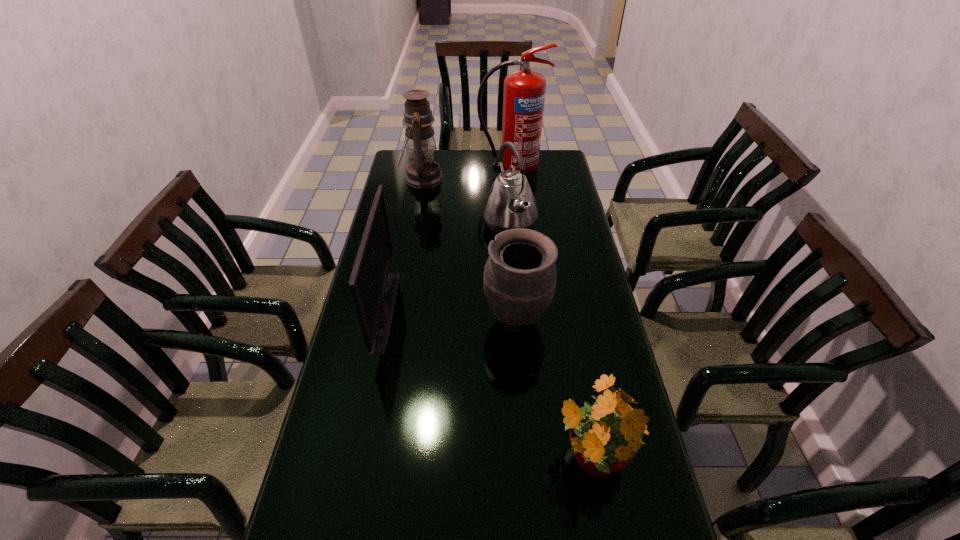
In the image, there is a desktop. Where is `vacant space at the left edge`? This screenshot has width=960, height=540. vacant space at the left edge is located at coordinates (349, 482).

At what (x,y) coordinates should I click in order to perform the action: click on vacant space at the right edge of the desktop. Please return your answer as a coordinate pair (x, y). Looking at the image, I should click on (537, 193).

Find the location of a particular element. This screenshot has height=540, width=960. vacant space at the far left corner of the desktop is located at coordinates (399, 148).

At what (x,y) coordinates should I click in order to perform the action: click on vacant area that lies between the oil lamp and the tallest object. Please return your answer as a coordinate pair (x, y). The image size is (960, 540). Looking at the image, I should click on (466, 177).

Where is `vacant space that's between the monitor and the urn`? The height and width of the screenshot is (540, 960). vacant space that's between the monitor and the urn is located at coordinates (451, 315).

Locate an element on the screen. This screenshot has height=540, width=960. free space between the monitor and the flowerpot is located at coordinates (488, 384).

Find the location of a particular element. empty space between the oil lamp and the fire extinguisher is located at coordinates (466, 177).

Image resolution: width=960 pixels, height=540 pixels. What are the coordinates of `vacant region between the monitor and the fire extinguisher` in the screenshot? It's located at (447, 243).

Where is `object identified as the fifth closest to the oil lamp`? object identified as the fifth closest to the oil lamp is located at coordinates (605, 435).

Choose which object is the second nearest neighbor to the oil lamp. Please provide its 2D coordinates. Your answer should be formatted as a tuple, i.e. [(x, y)], where the tuple contains the x and y coordinates of a point satisfying the conditions above.

[(510, 204)]